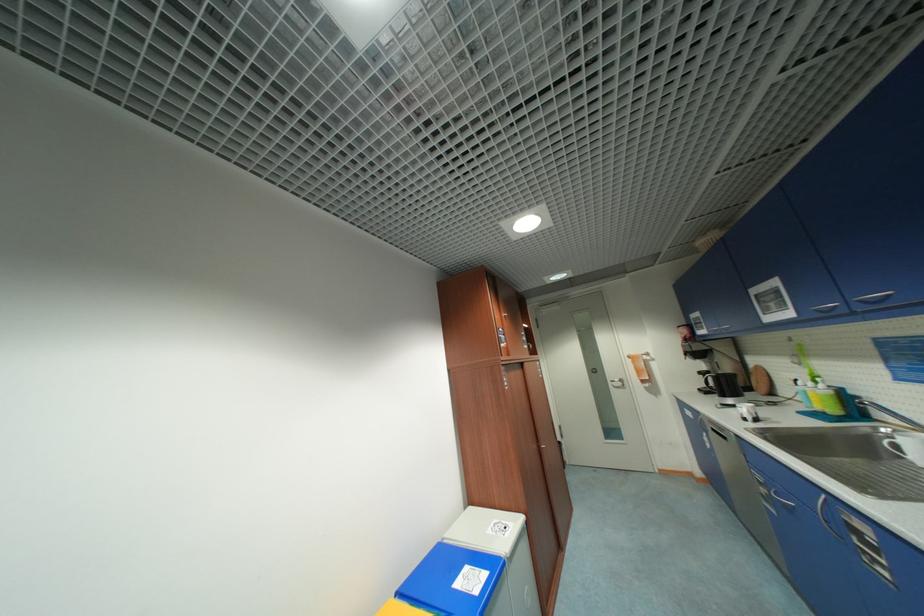
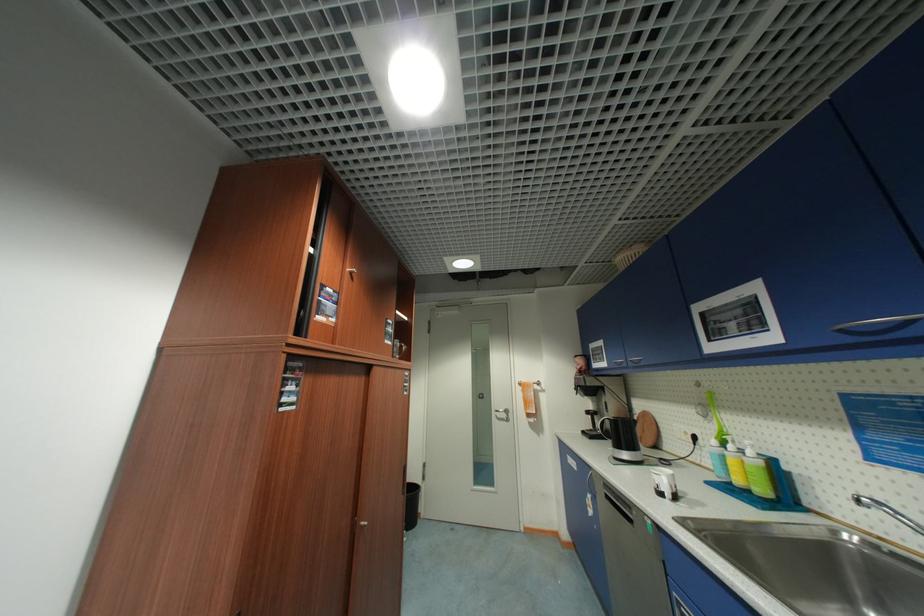
Question: How did the camera likely rotate?

Choices:
 (A) Left
 (B) Right
 (C) Up
 (D) Down

Answer: (B)